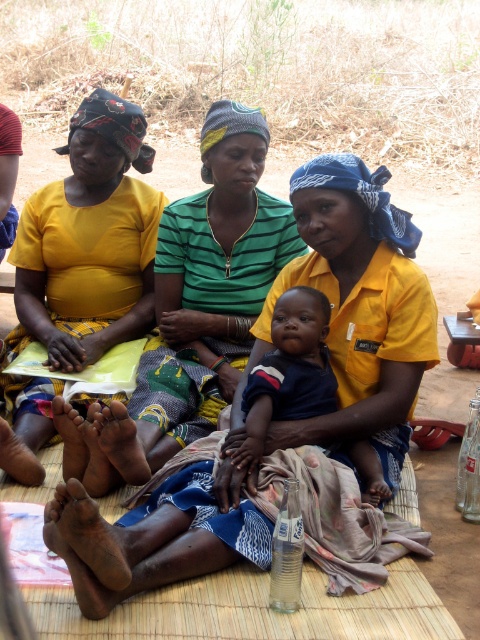
Question: Which object is positioned farthest from the blue textured fabric at lower center?

Choices:
 (A) yellow fabric at left
 (B) dark blue cotton shirt at center

Answer: (A)

Question: Which point appears farthest from the camera in this image?

Choices:
 (A) (241, 465)
 (B) (175, 275)
 (C) (196, 456)
 (D) (110, 332)

Answer: (D)

Question: Which point is closer to the camera taking this photo?

Choices:
 (A) (323, 362)
 (B) (217, 184)
 (C) (35, 324)
 (D) (156, 496)

Answer: (D)

Question: Is the position of yellow fabric at left less distant than that of dark blue cotton shirt at center?

Choices:
 (A) yes
 (B) no

Answer: (B)

Question: Does blue textured fabric at lower center appear over dark blue cotton shirt at center?

Choices:
 (A) no
 (B) yes

Answer: (A)

Question: Is yellow fabric at upper left bigger than dark blue cotton shirt at center?

Choices:
 (A) no
 (B) yes

Answer: (B)